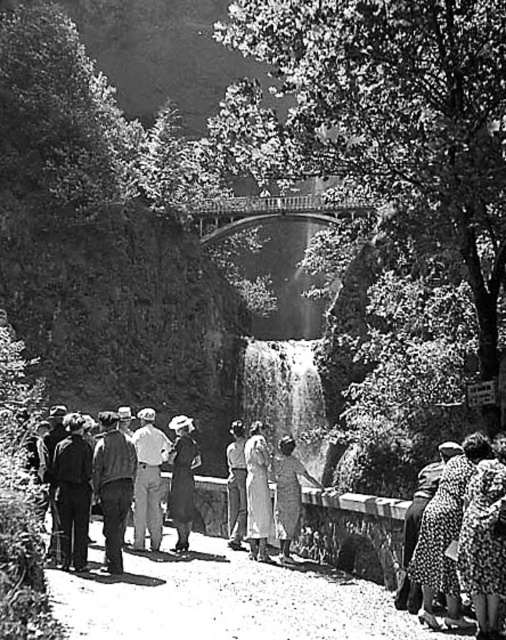
You are standing on the paved pathway in front of the waterfall and see both the dark brown leather coat at center and the smooth fabric dress at center. Which one is nearer to you?

The dark brown leather coat at center is closer to the viewer than the smooth fabric dress at center, so the dark brown leather coat at center is nearer to you.

You are standing on the paved pathway in front of the waterfall and notice two people wearing a denim jacket at center and a light gray cotton shirt at center. Which clothing item is closer to you?

The denim jacket at center is closer to you than the light gray cotton shirt at center.

You are standing at the point marked by the coordinates point (444,534). Looking towards the waterfall, which direction should you turn to face the dotted fabric dress at lower right?

The dotted fabric dress at lower right is already at your current position marked by point (444,534), so you don not need to turn. You are already facing it.